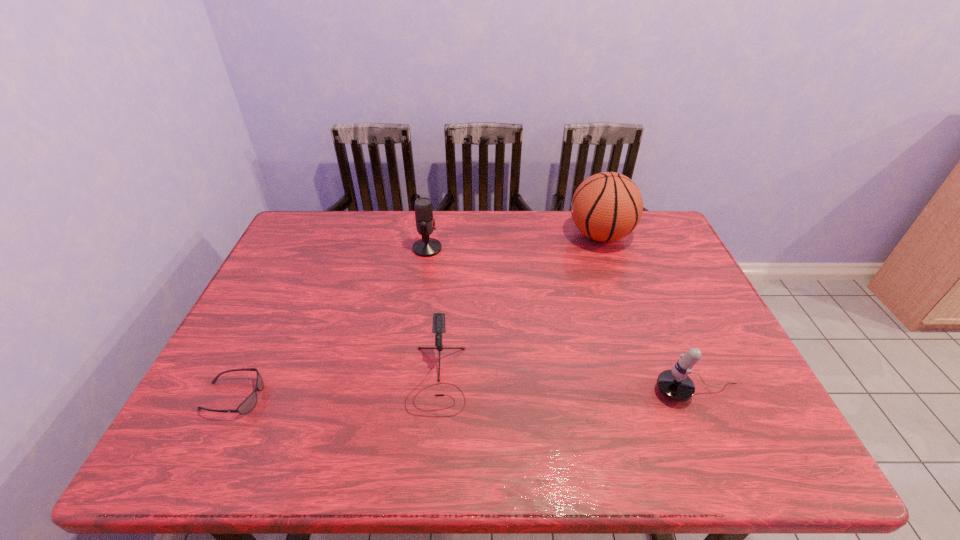
At what (x,y) coordinates should I click in order to perform the action: click on empty space that is in between the sunglasses and the basketball. Please return your answer as a coordinate pair (x, y). The image size is (960, 540). Looking at the image, I should click on (417, 316).

Locate an element on the screen. This screenshot has height=540, width=960. vacant space in between the basketball and the second tallest microphone is located at coordinates (649, 314).

This screenshot has width=960, height=540. In order to click on unoccupied area between the tallest microphone and the tallest object in this screenshot , I will do `click(514, 242)`.

Where is `vacant space that is in between the tallest object and the third shortest object`? The width and height of the screenshot is (960, 540). vacant space that is in between the tallest object and the third shortest object is located at coordinates (649, 314).

Identify the location of empty space between the fourth tallest object and the tallest object. Image resolution: width=960 pixels, height=540 pixels. (518, 307).

Where is `free spot between the fourth shortest object and the leftmost object`? The width and height of the screenshot is (960, 540). free spot between the fourth shortest object and the leftmost object is located at coordinates (330, 323).

At what (x,y) coordinates should I click in order to perform the action: click on vacant space that's between the third tallest object and the tallest object. Please return your answer as a coordinate pair (x, y). The width and height of the screenshot is (960, 540). Looking at the image, I should click on (649, 314).

Where is `object identified as the closest to the tallest microphone`? object identified as the closest to the tallest microphone is located at coordinates (438, 327).

Locate which object is the third closest to the leftmost object. Please provide its 2D coordinates. Your answer should be formatted as a tuple, i.e. [(x, y)], where the tuple contains the x and y coordinates of a point satisfying the conditions above.

[(674, 384)]

Find the location of a particular element. This screenshot has height=540, width=960. microphone identified as the second closest to the shortest object is located at coordinates (426, 247).